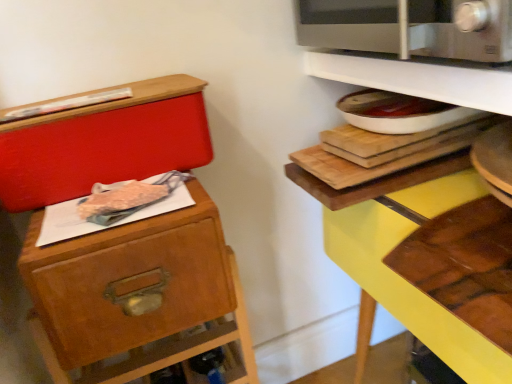
Where is `empty space that is ontop of wooden drawer at left (from a real-world perspective)`? Image resolution: width=512 pixels, height=384 pixels. empty space that is ontop of wooden drawer at left (from a real-world perspective) is located at coordinates (114, 212).